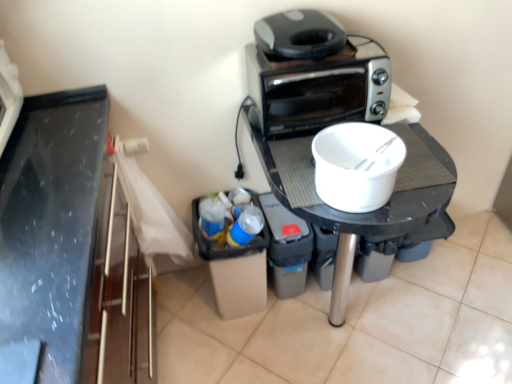
Question: From the image's perspective, is black plastic trash can at lower center below gray plastic toaster oven at upper right?

Choices:
 (A) yes
 (B) no

Answer: (A)

Question: Is black plastic trash can at lower center directly adjacent to gray plastic toaster oven at upper right?

Choices:
 (A) no
 (B) yes

Answer: (A)

Question: Is black plastic trash can at lower center shorter than gray plastic toaster oven at upper right?

Choices:
 (A) no
 (B) yes

Answer: (A)

Question: Is black plastic trash can at lower center to the left of gray plastic toaster oven at upper right from the viewer's perspective?

Choices:
 (A) no
 (B) yes

Answer: (B)

Question: From the image's perspective, is black plastic trash can at lower center on top of gray plastic toaster oven at upper right?

Choices:
 (A) no
 (B) yes

Answer: (A)

Question: From a real-world perspective, is black plastic trash can at lower center located higher than gray plastic toaster oven at upper right?

Choices:
 (A) yes
 (B) no

Answer: (B)

Question: Is black plastic table at center oriented towards black plastic trash can at lower center?

Choices:
 (A) yes
 (B) no

Answer: (B)

Question: Is black plastic table at center completely or partially outside of black plastic trash can at lower center?

Choices:
 (A) yes
 (B) no

Answer: (A)

Question: Is black plastic table at center bigger than black plastic trash can at lower center?

Choices:
 (A) no
 (B) yes

Answer: (B)

Question: Would you say black plastic trash can at lower center is part of black plastic table at center's contents?

Choices:
 (A) yes
 (B) no

Answer: (A)

Question: Can you confirm if black plastic table at center is wider than black plastic trash can at lower center?

Choices:
 (A) no
 (B) yes

Answer: (B)

Question: From a real-world perspective, is black plastic table at center under black plastic trash can at lower center?

Choices:
 (A) yes
 (B) no

Answer: (B)

Question: Is black plastic table at center placed right next to gray plastic toaster oven at upper right?

Choices:
 (A) yes
 (B) no

Answer: (B)